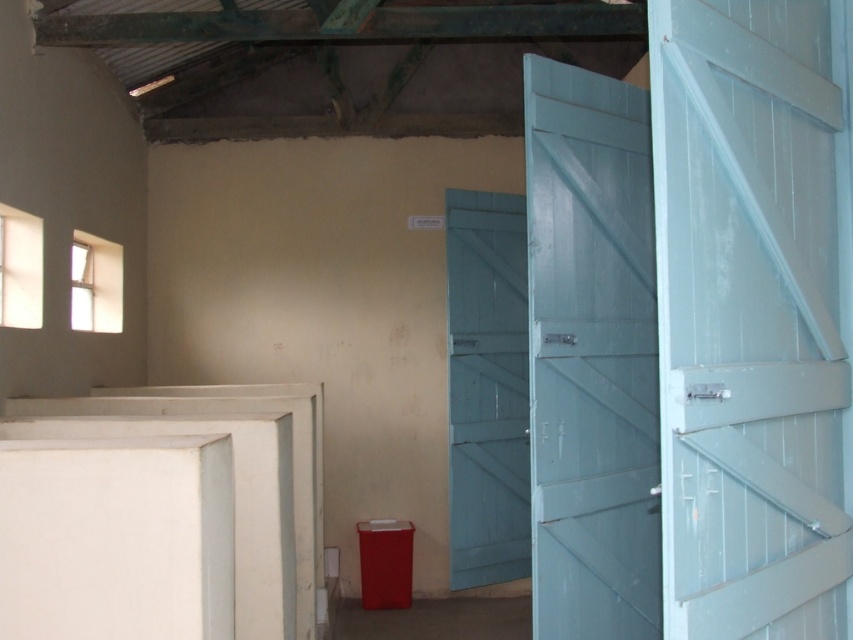
You are standing at point A located at point (637,416). You need to walk to point B which is 3.66 meters away. Will you be able to walk straight to point B without any obstacles?

Yes, you can walk straight to point B because there are no obstacles mentioned between point A and point B in the scene description.

You are a delivery person carrying a large package that requires 8 feet of clearance to move through. You need to navigate between the light blue wooden door at right and the light blue wooden door at center. Can you pass through the space between them with your package?

The light blue wooden door at right and light blue wooden door at center are 7.14 feet apart, which is less than the required 8 feet of clearance. Therefore, you cannot pass through the space between them with your package.